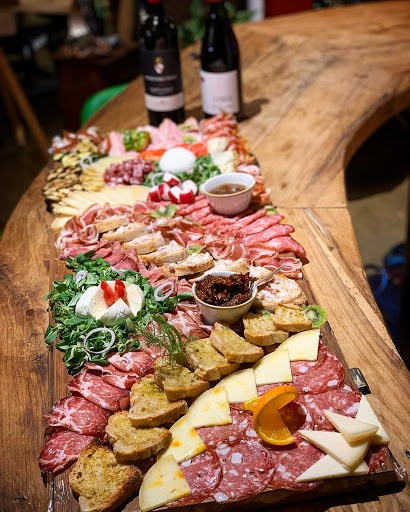
What are the coordinates of `wood grain` in the screenshot? It's located at (51, 391), (40, 365), (30, 248), (36, 255), (335, 278), (321, 169).